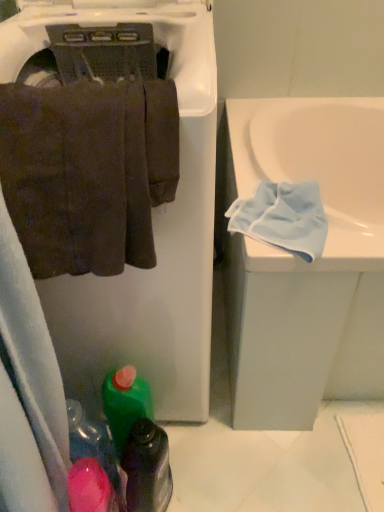
Measure the distance between green plastic bottle at lower center, acting as the 1th bottle starting from the left, and camera.

The depth of green plastic bottle at lower center, acting as the 1th bottle starting from the left, is 31.40 inches.

The image size is (384, 512). I want to click on brown cotton towel at left, so click(x=88, y=172).

Which is in front, green plastic bottle at lower center, acting as the 2th bottle starting from the left, or light blue microfiber cloth at right?

Positioned in front is light blue microfiber cloth at right.

From a real-world perspective, is green plastic bottle at lower center, placed as the 1th bottle when sorted from right to left, below light blue microfiber cloth at right?

Yes.

Is point (147, 496) in front of point (276, 212)?

No, it is not.

Is light blue microfiber cloth at right located within green plastic bottle at lower center, placed as the 1th bottle when sorted from right to left?

That's incorrect, light blue microfiber cloth at right is not inside green plastic bottle at lower center, placed as the 1th bottle when sorted from right to left.

In the image, is green plastic bottle at lower center, acting as the 2th bottle starting from the left, on the left side or the right side of brown cotton towel at left?

Based on their positions, green plastic bottle at lower center, acting as the 2th bottle starting from the left, is located to the right of brown cotton towel at left.

In the scene shown: Considering the relative positions of green plastic bottle at lower center, placed as the 1th bottle when sorted from right to left, and brown cotton towel at left in the image provided, is green plastic bottle at lower center, placed as the 1th bottle when sorted from right to left, behind brown cotton towel at left?

Yes, green plastic bottle at lower center, placed as the 1th bottle when sorted from right to left, is further from the camera.

Is point (153, 494) farther from camera compared to point (113, 101)?

That is True.

Considering the sizes of objects green plastic bottle at lower center, placed as the 1th bottle when sorted from right to left, and brown cotton towel at left in the image provided, who is bigger, green plastic bottle at lower center, placed as the 1th bottle when sorted from right to left, or brown cotton towel at left?

With larger size is brown cotton towel at left.

Is green plastic bottle at lower center, marked as the 2th bottle in a right-to-left arrangement, touching brown cotton towel at left?

They are not placed beside each other.

From the image's perspective, is green plastic bottle at lower center, acting as the 1th bottle starting from the left, located above or below brown cotton towel at left?

Based on their image positions, green plastic bottle at lower center, acting as the 1th bottle starting from the left, is located beneath brown cotton towel at left.

Is green plastic bottle at lower center, marked as the 2th bottle in a right-to-left arrangement, outside of brown cotton towel at left?

green plastic bottle at lower center, marked as the 2th bottle in a right-to-left arrangement, is positioned outside brown cotton towel at left.

Is green plastic bottle at lower center, acting as the 1th bottle starting from the left, smaller than brown cotton towel at left?

Yes, green plastic bottle at lower center, acting as the 1th bottle starting from the left, is smaller than brown cotton towel at left.

Based on the photo, which is more to the left, light blue microfiber cloth at right or brown cotton towel at left?

From the viewer's perspective, brown cotton towel at left appears more on the left side.

Is light blue microfiber cloth at right wider than brown cotton towel at left?

Correct, the width of light blue microfiber cloth at right exceeds that of brown cotton towel at left.

What's the angular difference between light blue microfiber cloth at right and brown cotton towel at left's facing directions?

3.42 degrees separate the facing orientations of light blue microfiber cloth at right and brown cotton towel at left.

Does light blue microfiber cloth at right have a larger size compared to brown cotton towel at left?

No.

Consider the image. Does green plastic bottle at lower center, placed as the 1th bottle when sorted from right to left, turn towards white matte dishwasher at upper left?

No, green plastic bottle at lower center, placed as the 1th bottle when sorted from right to left, is not facing towards white matte dishwasher at upper left.

From the image's perspective, who appears lower, green plastic bottle at lower center, acting as the 2th bottle starting from the left, or white matte dishwasher at upper left?

green plastic bottle at lower center, acting as the 2th bottle starting from the left.

Is green plastic bottle at lower center, placed as the 1th bottle when sorted from right to left, taller than white matte dishwasher at upper left?

Incorrect, the height of green plastic bottle at lower center, placed as the 1th bottle when sorted from right to left, is not larger of that of white matte dishwasher at upper left.

Is brown cotton towel at left oriented away from green plastic bottle at lower center, acting as the 2th bottle starting from the left?

No, green plastic bottle at lower center, acting as the 2th bottle starting from the left, is not at the back of brown cotton towel at left.

Is brown cotton towel at left not close to green plastic bottle at lower center, placed as the 1th bottle when sorted from right to left?

brown cotton towel at left is actually quite close to green plastic bottle at lower center, placed as the 1th bottle when sorted from right to left.

Is point (106, 197) farther from camera compared to point (132, 493)?

No, (106, 197) is closer to viewer.

Does brown cotton towel at left have a lesser height compared to green plastic bottle at lower center, placed as the 1th bottle when sorted from right to left?

Yes.

What's the angular difference between white matte dishwasher at upper left and brown cotton towel at left's facing directions?

The facing directions of white matte dishwasher at upper left and brown cotton towel at left are 4.19e-05 degrees apart.

Between white matte dishwasher at upper left and brown cotton towel at left, which one has smaller width?

With smaller width is brown cotton towel at left.

The height and width of the screenshot is (512, 384). I want to click on towel located on the right of white matte dishwasher at upper left, so click(x=88, y=172).

From a real-world perspective, is white matte dishwasher at upper left positioned above or below brown cotton towel at left?

white matte dishwasher at upper left is situated lower than brown cotton towel at left in the real world.

Where is `the 1st bottle behind the light blue microfiber cloth at right`? Image resolution: width=384 pixels, height=512 pixels. the 1st bottle behind the light blue microfiber cloth at right is located at coordinates (147, 468).

This screenshot has height=512, width=384. In order to click on towel that appears in front of the green plastic bottle at lower center, placed as the 1th bottle when sorted from right to left in this screenshot , I will do pyautogui.click(x=88, y=172).

Looking at the image, which one is located further to brown cotton towel at left, light blue microfiber cloth at right or green plastic bottle at lower center, acting as the 2th bottle starting from the left?

Based on the image, green plastic bottle at lower center, acting as the 2th bottle starting from the left, appears to be further to brown cotton towel at left.

Based on their spatial positions, is green plastic bottle at lower center, acting as the 1th bottle starting from the left, or light blue microfiber cloth at right further from green plastic bottle at lower center, acting as the 2th bottle starting from the left?

light blue microfiber cloth at right lies further to green plastic bottle at lower center, acting as the 2th bottle starting from the left, than the other object.

Estimate the real-world distances between objects in this image. Which object is closer to white matte dishwasher at upper left, green plastic bottle at lower center, acting as the 1th bottle starting from the left, or green plastic bottle at lower center, acting as the 2th bottle starting from the left?

green plastic bottle at lower center, acting as the 1th bottle starting from the left, is positioned closer to the anchor white matte dishwasher at upper left.

When comparing their distances from green plastic bottle at lower center, acting as the 1th bottle starting from the left, does green plastic bottle at lower center, placed as the 1th bottle when sorted from right to left, or light blue microfiber cloth at right seem further?

Based on the image, light blue microfiber cloth at right appears to be further to green plastic bottle at lower center, acting as the 1th bottle starting from the left.

Considering their positions, is white matte dishwasher at upper left positioned further to brown cotton towel at left than green plastic bottle at lower center, placed as the 1th bottle when sorted from right to left?

green plastic bottle at lower center, placed as the 1th bottle when sorted from right to left.

Which object lies further to the anchor point light blue microfiber cloth at right, green plastic bottle at lower center, acting as the 1th bottle starting from the left, or green plastic bottle at lower center, acting as the 2th bottle starting from the left?

Based on the image, green plastic bottle at lower center, acting as the 2th bottle starting from the left, appears to be further to light blue microfiber cloth at right.

Based on their spatial positions, is brown cotton towel at left or green plastic bottle at lower center, placed as the 1th bottle when sorted from right to left, closer to light blue microfiber cloth at right?

brown cotton towel at left lies closer to light blue microfiber cloth at right than the other object.

Which object lies further to the anchor point white matte dishwasher at upper left, green plastic bottle at lower center, placed as the 1th bottle when sorted from right to left, or green plastic bottle at lower center, marked as the 2th bottle in a right-to-left arrangement?

Among the two, green plastic bottle at lower center, placed as the 1th bottle when sorted from right to left, is located further to white matte dishwasher at upper left.

Where is `bath towel between white matte dishwasher at upper left and green plastic bottle at lower center, placed as the 1th bottle when sorted from right to left, vertically`? The width and height of the screenshot is (384, 512). bath towel between white matte dishwasher at upper left and green plastic bottle at lower center, placed as the 1th bottle when sorted from right to left, vertically is located at coordinates (283, 218).

The width and height of the screenshot is (384, 512). I want to click on bottle between brown cotton towel at left and green plastic bottle at lower center, placed as the 1th bottle when sorted from right to left, in the up-down direction, so click(125, 403).

The height and width of the screenshot is (512, 384). What are the coordinates of `bottle that lies between light blue microfiber cloth at right and green plastic bottle at lower center, placed as the 1th bottle when sorted from right to left, from top to bottom` in the screenshot? It's located at (125, 403).

This screenshot has width=384, height=512. I want to click on dish washer that lies between brown cotton towel at left and green plastic bottle at lower center, acting as the 1th bottle starting from the left, from top to bottom, so click(x=152, y=209).